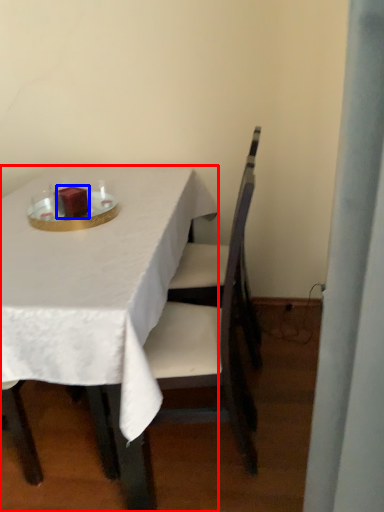
Question: Among these objects, which one is nearest to the camera, table (highlighted by a red box) or candle (highlighted by a blue box)?

Choices:
 (A) table
 (B) candle

Answer: (A)